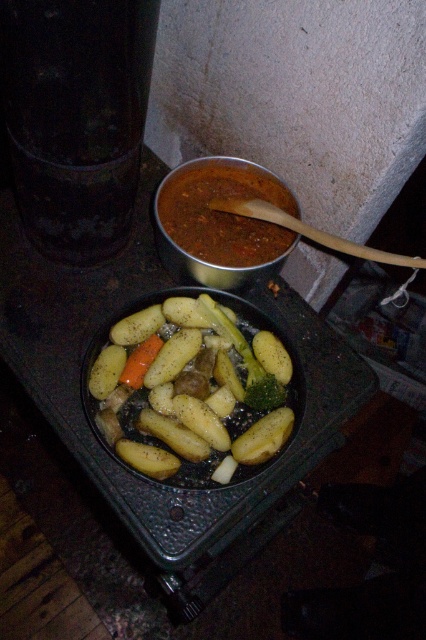
Can you confirm if smooth yellow potatoes at center is thinner than green matte broccoli at center?

Incorrect, smooth yellow potatoes at center's width is not less than green matte broccoli at center's.

At what (x,y) coordinates should I click in order to perform the action: click on smooth yellow potatoes at center. Please return your answer as a coordinate pair (x, y). This screenshot has width=426, height=640. Looking at the image, I should click on (192, 390).

I want to click on smooth yellow potatoes at center, so click(192, 390).

From the picture: Does smooth yellow potatoes at center have a lesser height compared to brown matte soup at center?

In fact, smooth yellow potatoes at center may be taller than brown matte soup at center.

Does smooth yellow potatoes at center appear over brown matte soup at center?

No, smooth yellow potatoes at center is not above brown matte soup at center.

Who is more forward, (141,336) or (227,188)?

Point (141,336)

Where is `smooth yellow potatoes at center`? smooth yellow potatoes at center is located at coordinates (192, 390).

Between brown matte soup at center and green matte broccoli at center, which one is positioned lower?

green matte broccoli at center is lower down.

Between point (199, 209) and point (262, 397), which one is positioned behind?

Positioned behind is point (199, 209).

Does point (199, 189) come in front of point (247, 385)?

No.

What are the coordinates of `brown matte soup at center` in the screenshot? It's located at (224, 212).